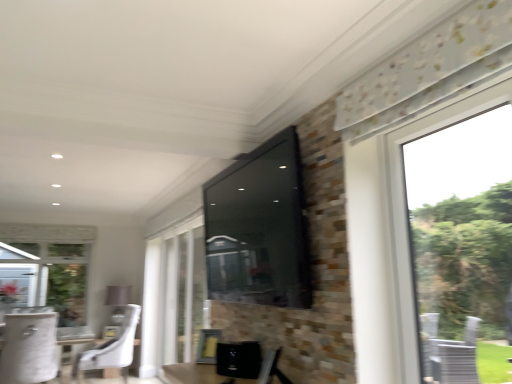
Question: Is white fabric chair at lower left, the first chair from the right, outside of matte black tv at upper center?

Choices:
 (A) yes
 (B) no

Answer: (A)

Question: Is white fabric chair at lower left, arranged as the second chair when viewed from the left, wider than matte black tv at upper center?

Choices:
 (A) no
 (B) yes

Answer: (B)

Question: Are white fabric chair at lower left, the first chair from the right, and matte black tv at upper center making contact?

Choices:
 (A) yes
 (B) no

Answer: (B)

Question: From the image's perspective, is white fabric chair at lower left, the first chair from the right, located beneath matte black tv at upper center?

Choices:
 (A) no
 (B) yes

Answer: (B)

Question: Is white fabric chair at lower left, arranged as the second chair when viewed from the left, positioned before matte black tv at upper center?

Choices:
 (A) yes
 (B) no

Answer: (B)

Question: Considering the positions of transparent glass window at center and matte black tv at upper center in the image, is transparent glass window at center bigger or smaller than matte black tv at upper center?

Choices:
 (A) big
 (B) small

Answer: (A)

Question: Considering the positions of transparent glass window at center and matte black tv at upper center in the image, is transparent glass window at center taller or shorter than matte black tv at upper center?

Choices:
 (A) short
 (B) tall

Answer: (B)

Question: Would you say transparent glass window at center is inside or outside matte black tv at upper center?

Choices:
 (A) outside
 (B) inside

Answer: (A)

Question: Is transparent glass window at center wider or thinner than matte black tv at upper center?

Choices:
 (A) thin
 (B) wide

Answer: (A)

Question: From the image's perspective, is matte black tv at upper center above or below white fabric round table at lower left?

Choices:
 (A) above
 (B) below

Answer: (A)

Question: Is matte black tv at upper center in front of or behind white fabric round table at lower left in the image?

Choices:
 (A) behind
 (B) front

Answer: (B)

Question: Visually, is matte black tv at upper center positioned to the left or to the right of white fabric round table at lower left?

Choices:
 (A) left
 (B) right

Answer: (B)

Question: From a real-world perspective, is matte black tv at upper center positioned above or below white fabric round table at lower left?

Choices:
 (A) below
 (B) above

Answer: (B)

Question: Is transparent glass window at center inside or outside of white fabric chair at lower left, which ranks as the second chair in right-to-left order?

Choices:
 (A) inside
 (B) outside

Answer: (B)

Question: Is point (161, 311) positioned closer to the camera than point (37, 321)?

Choices:
 (A) farther
 (B) closer

Answer: (A)